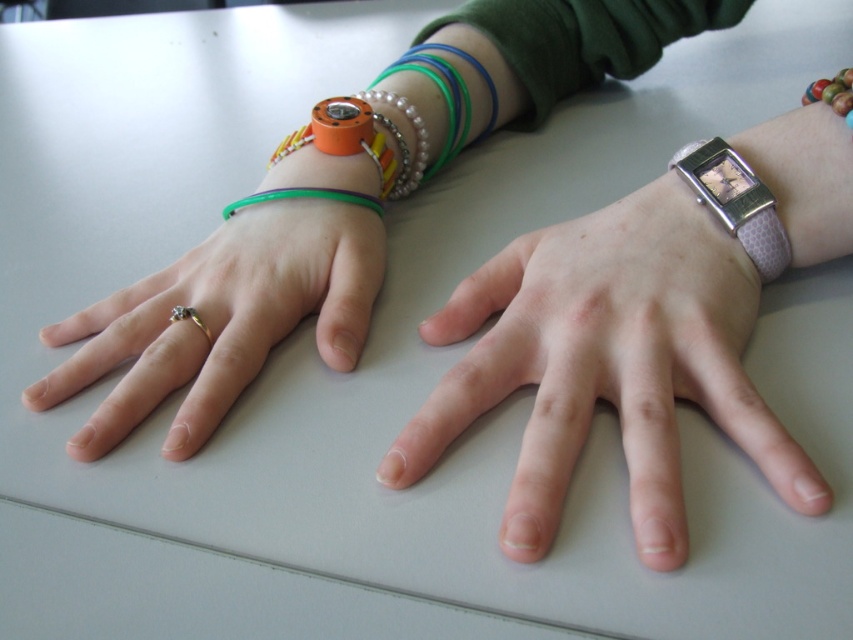
You are a jeweler examining two items on a table. You see the gold metallic ring at left and the green rubber bracelet at left. Which item is taller?

The gold metallic ring at left has a greater height compared to the green rubber bracelet at left, so the gold metallic ring at left is taller.

You are a photographer adjusting your camera settings to capture the gold metallic ring at left. The camera has a focal length of 50mm. To ensure the ring is in sharp focus, what distance should you set the focus ring to?

The gold metallic ring at left is 23.64 inches away from viewer, so you should set the focus ring to 23.64 inches to ensure it is in sharp focus.